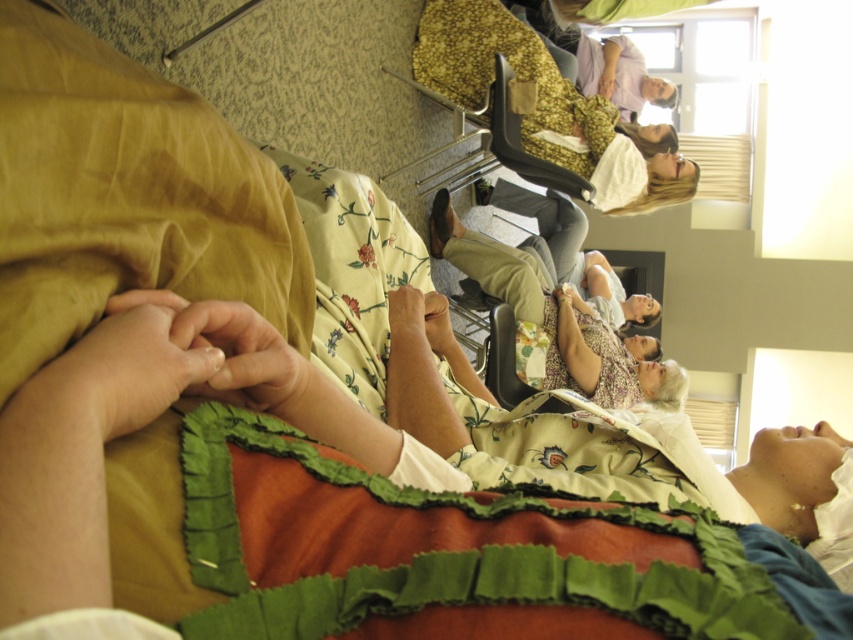
You are standing in the room and want to place a small vase on the floor near the floral fabric dress at upper center. Based on its position, where should you place the vase relative to the dress?

The floral fabric dress at upper center is located at point (514, 81), so you should place the vase near that coordinate on the floor to be close to the dress.

You are an interior designer assessing the layout of a room. You notice two floral fabric dresses in the scene. The first is labeled as the floral fabric dress at upper center and the second as the floral fabric dress at center. Based on their positions, which dress is positioned higher in the room?

The floral fabric dress at upper center is positioned higher in the room than the floral fabric dress at center.